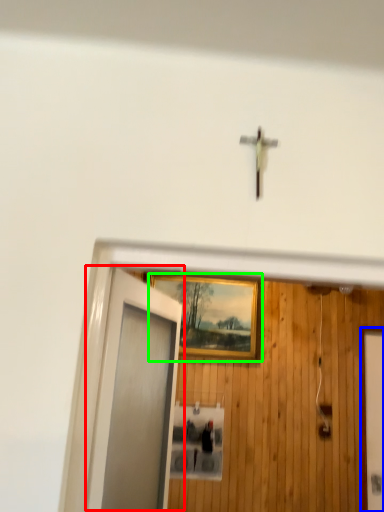
Question: Which is nearer to the door (highlighted by a red box)? elevator door (highlighted by a blue box) or picture frame (highlighted by a green box).

Choices:
 (A) elevator door
 (B) picture frame

Answer: (B)